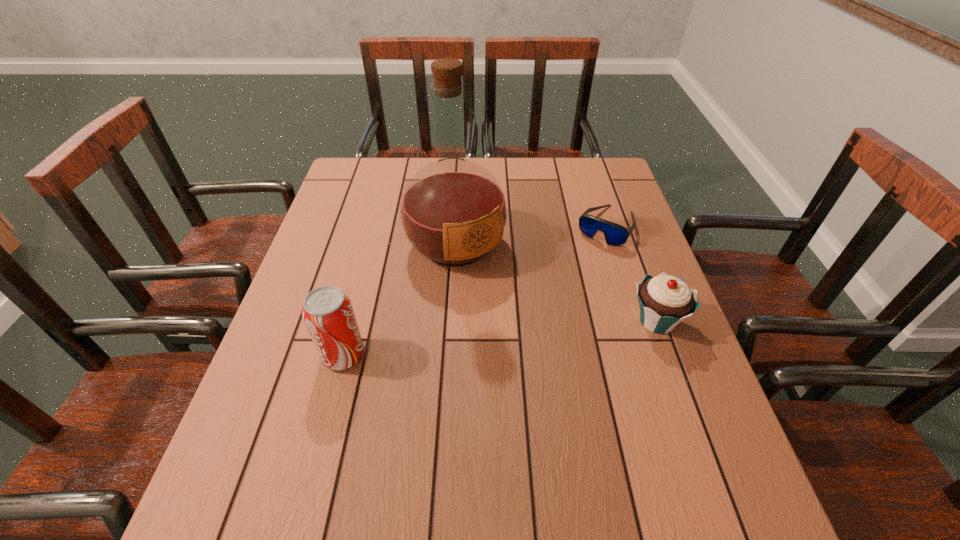
The height and width of the screenshot is (540, 960). Find the location of `the leftmost object`. the leftmost object is located at coordinates (328, 314).

I want to click on the third shortest object, so click(328, 314).

This screenshot has height=540, width=960. Identify the location of cupcake. (665, 301).

Find the location of a particular element. The width and height of the screenshot is (960, 540). the shortest object is located at coordinates (615, 235).

Image resolution: width=960 pixels, height=540 pixels. Identify the location of the tallest object. (453, 211).

At what (x,y) coordinates should I click in order to perform the action: click on the third object from right to left. Please return your answer as a coordinate pair (x, y). Looking at the image, I should click on (453, 211).

The image size is (960, 540). I want to click on free space located on the logo side of the second tallest object, so click(x=393, y=355).

The image size is (960, 540). I want to click on free space located on the front of the third tallest object, so click(x=708, y=462).

I want to click on vacant area situated 0.240m on the front-facing side of the sunglasses, so click(x=560, y=300).

This screenshot has width=960, height=540. What are the coordinates of `vacant space located on the front-facing side of the sunglasses` in the screenshot? It's located at (564, 293).